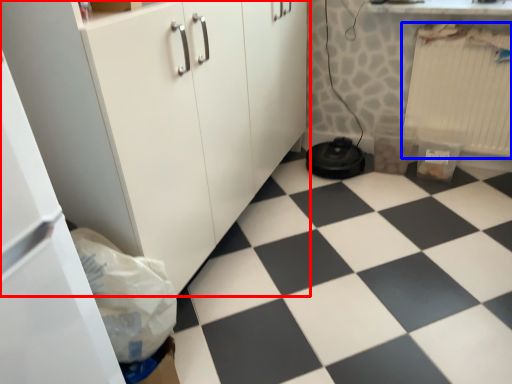
Question: Which of the following is the closest to the observer, cabinetry (highlighted by a red box) or radiator (highlighted by a blue box)?

Choices:
 (A) cabinetry
 (B) radiator

Answer: (A)